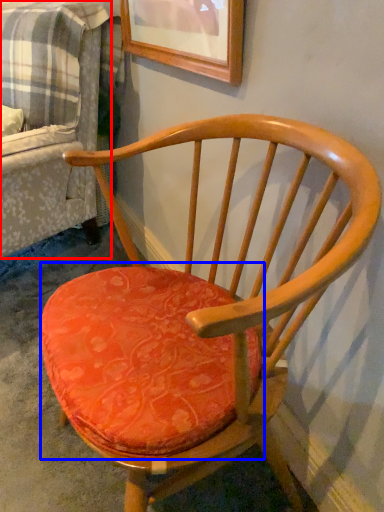
Question: Which of the following is the farthest to the observer, couch (highlighted by a red box) or table (highlighted by a blue box)?

Choices:
 (A) couch
 (B) table

Answer: (A)